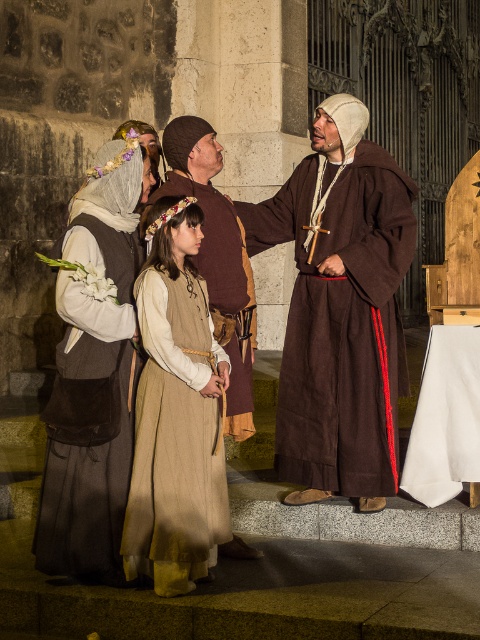
Does point (97, 380) lie behind point (202, 296)?

No, it is in front of (202, 296).

How distant is matte brown dress at left from beige woolen dress at center?

The distance of matte brown dress at left from beige woolen dress at center is 20.07 inches.

Is point (88, 403) positioned behind point (178, 474)?

Yes, point (88, 403) is behind point (178, 474).

This screenshot has height=640, width=480. I want to click on matte brown dress at left, so click(x=95, y=371).

Between brown linen robe at center and beige woolen dress at center, which one has less height?

beige woolen dress at center is shorter.

Between brown linen robe at center and beige woolen dress at center, which one appears on the right side from the viewer's perspective?

Positioned to the right is brown linen robe at center.

Who is more distant from viewer, (333,300) or (201,230)?

The point (333,300) is more distant.

Identify the location of brown linen robe at center. tap(339, 308).

Can you confirm if brown linen robe at center is smaller than matte brown dress at left?

Actually, brown linen robe at center might be larger than matte brown dress at left.

Does brown linen robe at center come in front of matte brown dress at left?

No, brown linen robe at center is further to the viewer.

Is point (317, 358) closer to camera compared to point (121, 394)?

No, (317, 358) is further to viewer.

The width and height of the screenshot is (480, 640). What are the coordinates of `brown linen robe at center` in the screenshot? It's located at (339, 308).